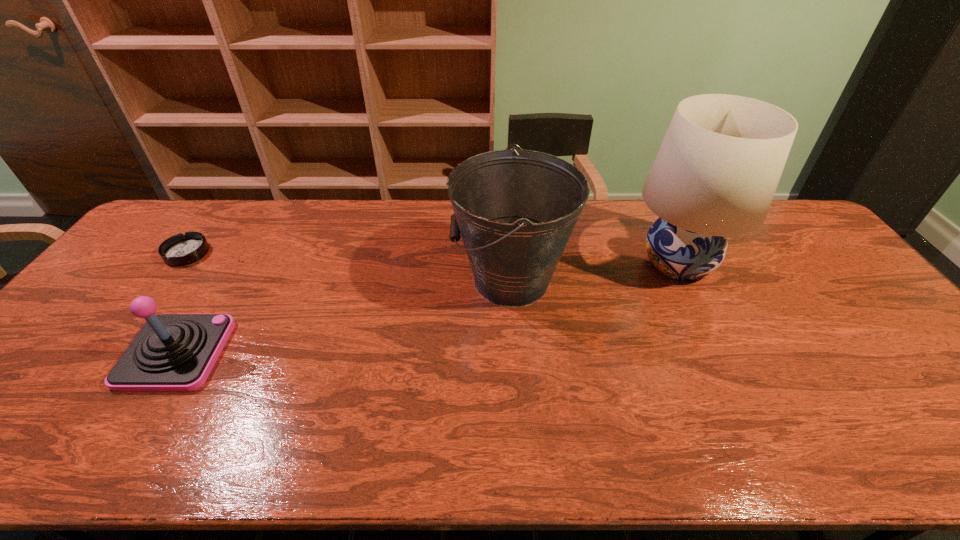
I want to click on vacant space that is in between the rightmost object and the second shortest object, so click(x=427, y=308).

At what (x,y) coordinates should I click in order to perform the action: click on unoccupied area between the rightmost object and the joystick. Please return your answer as a coordinate pair (x, y). This screenshot has height=540, width=960. Looking at the image, I should click on (427, 308).

I want to click on vacant space that is in between the lampshade and the joystick, so click(x=427, y=308).

Find the location of a particular element. object that is the second closest to the third object from left to right is located at coordinates (172, 352).

Locate an element on the screen. The width and height of the screenshot is (960, 540). object that is the second closest one to the third shortest object is located at coordinates (172, 352).